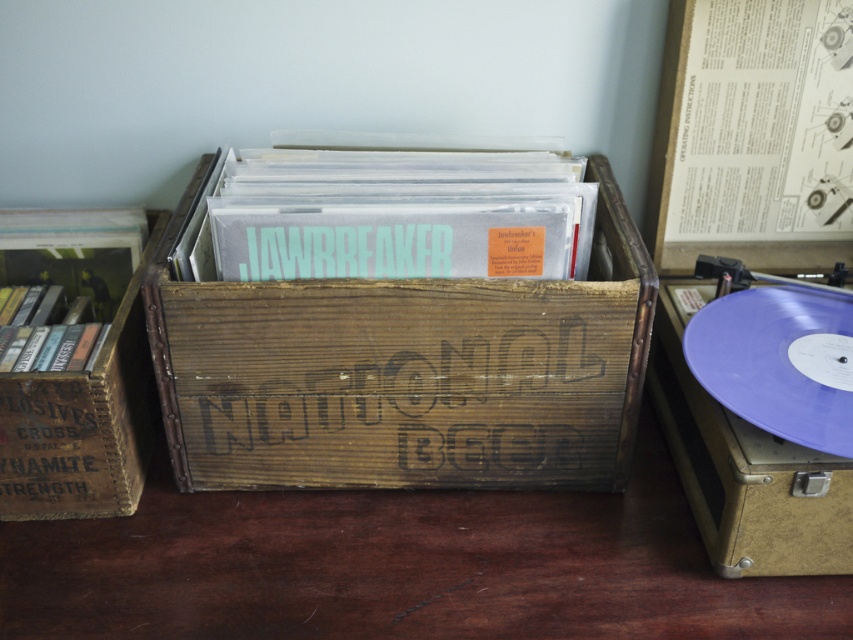
Question: From the image, what is the correct spatial relationship of purple vinyl record player at right in relation to brown wooden crate at left?

Choices:
 (A) below
 (B) above

Answer: (A)

Question: Is wooden crate at center positioned behind brown wooden crate at left?

Choices:
 (A) no
 (B) yes

Answer: (B)

Question: Which point is farther to the camera?

Choices:
 (A) wooden crate at center
 (B) purple vinyl record player at right

Answer: (A)

Question: Can you confirm if purple vinyl record player at right is positioned to the right of brown wooden crate at left?

Choices:
 (A) no
 (B) yes

Answer: (B)

Question: Among these points, which one is nearest to the camera?

Choices:
 (A) (677, 342)
 (B) (0, 397)

Answer: (B)

Question: Which point is closer to the camera taking this photo?

Choices:
 (A) (686, 284)
 (B) (521, 292)

Answer: (B)